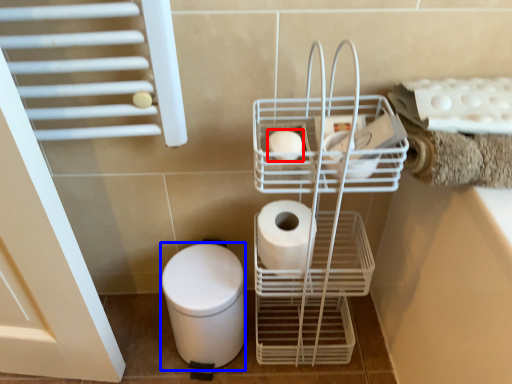
Question: Which of the following is the closest to the observer, toilet paper (highlighted by a red box) or bidet (highlighted by a blue box)?

Choices:
 (A) toilet paper
 (B) bidet

Answer: (A)